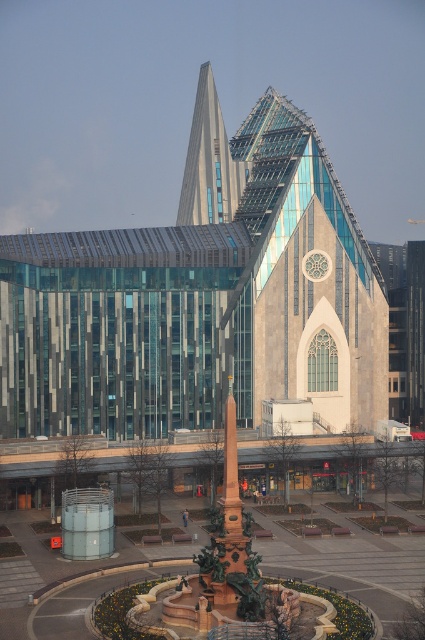
Question: Which object appears farthest from the camera in this image?

Choices:
 (A) white stone tower at center
 (B) stone church at center
 (C) transparent glass tower at center

Answer: (C)

Question: Which object appears closest to the camera in this image?

Choices:
 (A) transparent glass tower at center
 (B) white stone tower at center
 (C) stone church at center
 (D) polished bronze obelisk at center

Answer: (D)

Question: Can you confirm if white stone tower at center is wider than transparent glass tower at center?

Choices:
 (A) yes
 (B) no

Answer: (A)

Question: Is stone church at center in front of transparent glass tower at center?

Choices:
 (A) yes
 (B) no

Answer: (A)

Question: Does stone church at center lie behind polished bronze obelisk at center?

Choices:
 (A) no
 (B) yes

Answer: (B)

Question: Which of the following is the farthest from the observer?

Choices:
 (A) (198, 212)
 (B) (254, 132)

Answer: (B)